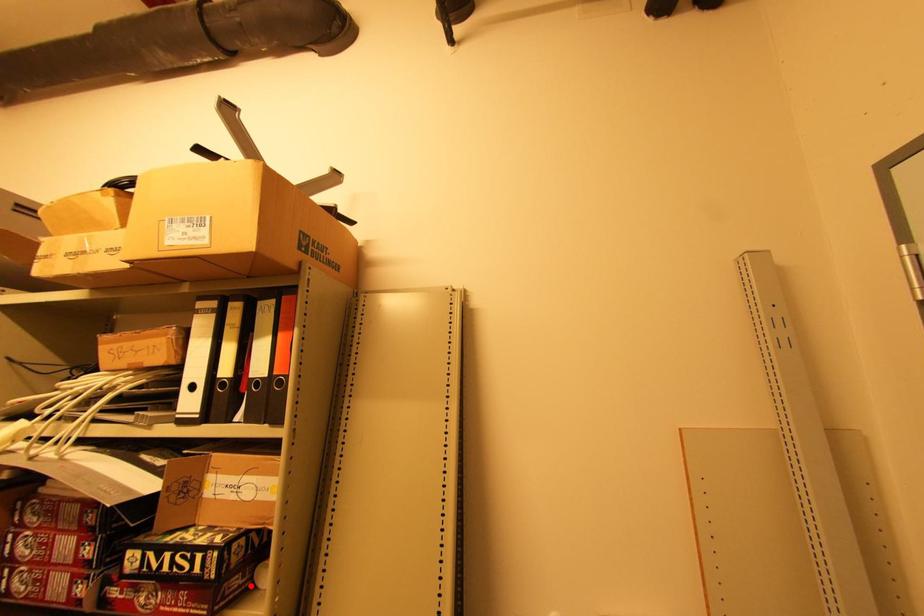
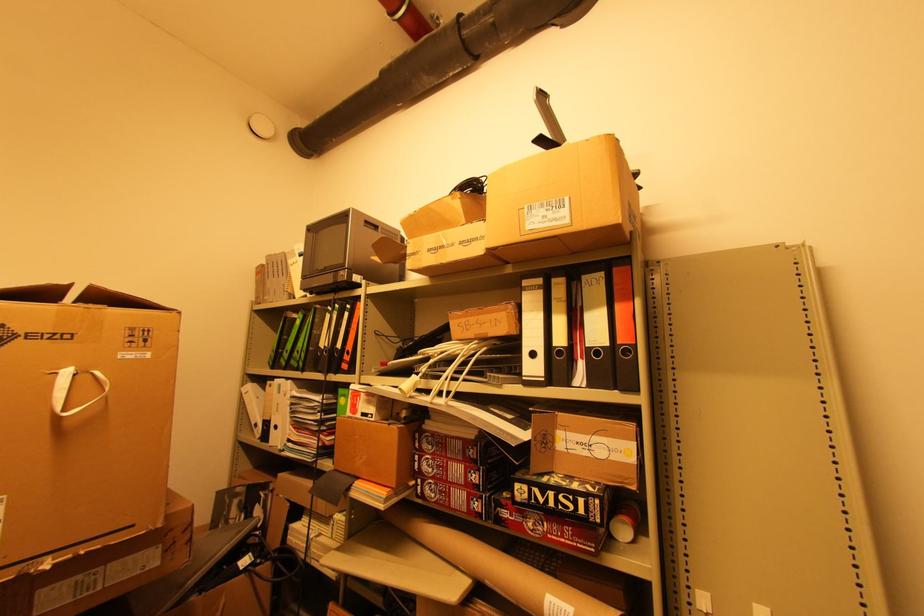
The point at the highlighted location is marked in the first image. Where is the corresponding point in the second image?

(611, 535)